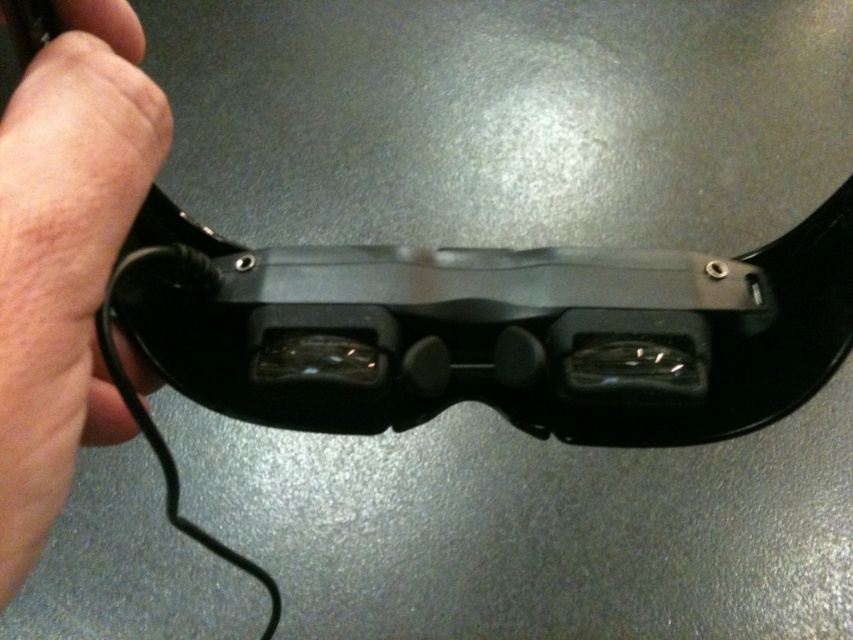
Can you confirm if black plastic goggles at center is positioned above pinky skin at lower left?

No, black plastic goggles at center is not above pinky skin at lower left.

Who is lower down, black plastic goggles at center or pinky skin at lower left?

black plastic goggles at center is lower down.

Describe the element at coordinates (486, 332) in the screenshot. I see `black plastic goggles at center` at that location.

This screenshot has width=853, height=640. I want to click on black plastic goggles at center, so click(486, 332).